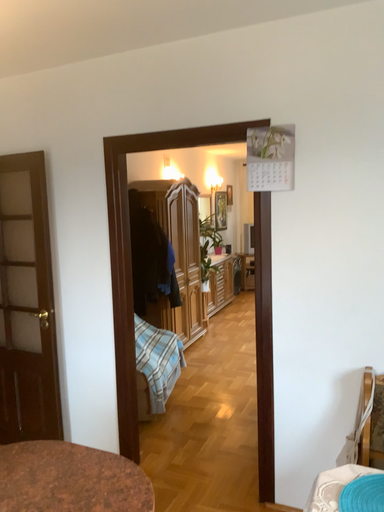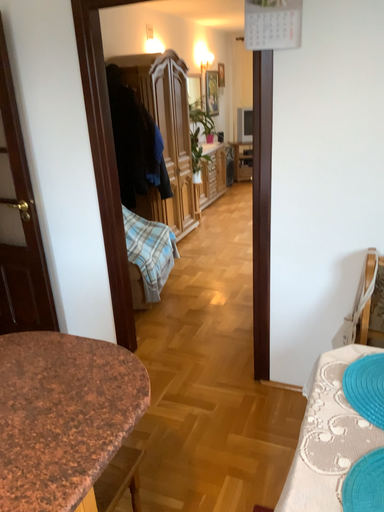
Question: How did the camera likely rotate when shooting the video?

Choices:
 (A) rotated upward
 (B) rotated downward

Answer: (B)